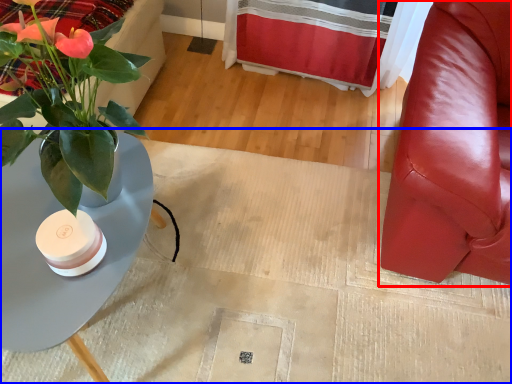
Question: Which point is further to the camera, chair (highlighted by a red box) or plain (highlighted by a blue box)?

Choices:
 (A) chair
 (B) plain

Answer: (B)